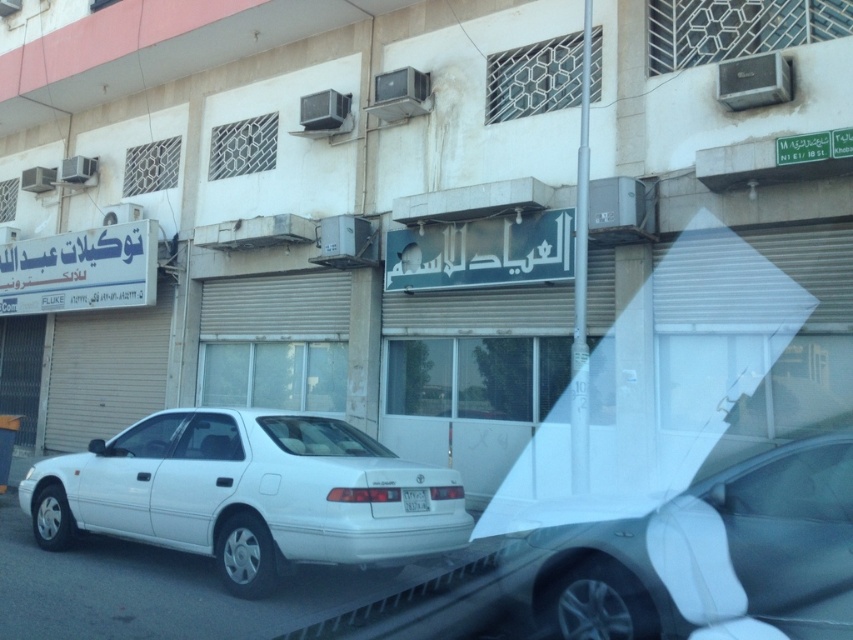
You are a delivery driver who needs to park your van near the white matte sedan at lower left and the white plastic license plate at center. Based on their positions, which object is closer to you so you can park next to it?

The white matte sedan at lower left is closer to the viewer than the white plastic license plate at center, so you should park next to the white matte sedan at lower left.

You are a delivery driver who needs to park your vehicle in a space that is exactly the height of the white plastic license plate at center. Can your white matte car at center fit into this parking space?

The white matte car at center is much taller than the white plastic license plate at center, so it cannot fit into a parking space that is only as tall as the license plate.

You are standing at the point with coordinates point (808, 605) and want to walk towards the point with coordinates point (421, 509). According to the scene, will you be moving towards the street or away from it?

Since point (808, 605) is in front of point (421, 509), moving from point (808, 605) towards point (421, 509) means you are moving away from the street towards the buildings.